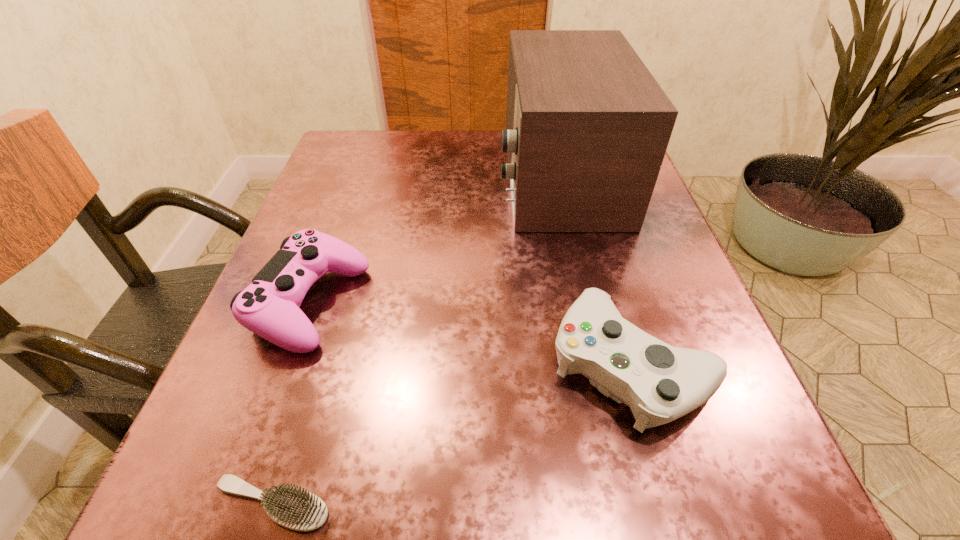
You are a GUI agent. You are given a task and a screenshot of the screen. Output one action in this format:
    pyautogui.click(x=<x>, y=<y>)
    Task: Click on the free location that satisfies the following two spatial constraints: 1. on the back side of the right control; 2. on the front-facing side of the tallest object
    The width and height of the screenshot is (960, 540).
    Given the screenshot: What is the action you would take?
    pyautogui.click(x=577, y=176)

The image size is (960, 540). Identify the location of vacant area that satisfies the following two spatial constraints: 1. on the front-facing side of the radio receiver; 2. on the left side of the right control. (600, 363).

Find the location of `free spot that satisfies the following two spatial constraints: 1. on the front side of the left control; 2. on the right side of the right control`. free spot that satisfies the following two spatial constraints: 1. on the front side of the left control; 2. on the right side of the right control is located at coordinates (289, 363).

The height and width of the screenshot is (540, 960). Find the location of `free spot that satisfies the following two spatial constraints: 1. on the front side of the left control; 2. on the left side of the right control`. free spot that satisfies the following two spatial constraints: 1. on the front side of the left control; 2. on the left side of the right control is located at coordinates (289, 363).

What are the coordinates of `vacant area that satisfies the following two spatial constraints: 1. on the front-facing side of the tallest object; 2. on the left side of the right control` in the screenshot? It's located at click(x=600, y=363).